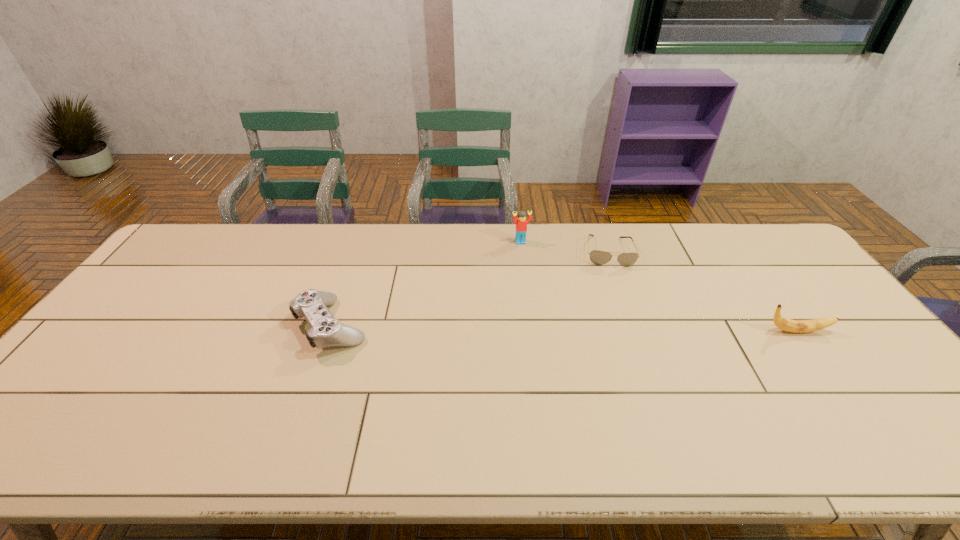
Locate an element on the screen. vacant space on the desktop that is between the third tallest object and the third shortest object and is positioned on the face of the third object from right to left is located at coordinates (548, 328).

Locate an element on the screen. The width and height of the screenshot is (960, 540). free spot on the desktop that is between the leftmost object and the second tallest object and is positioned on the front-facing side of the second object from right to left is located at coordinates (621, 329).